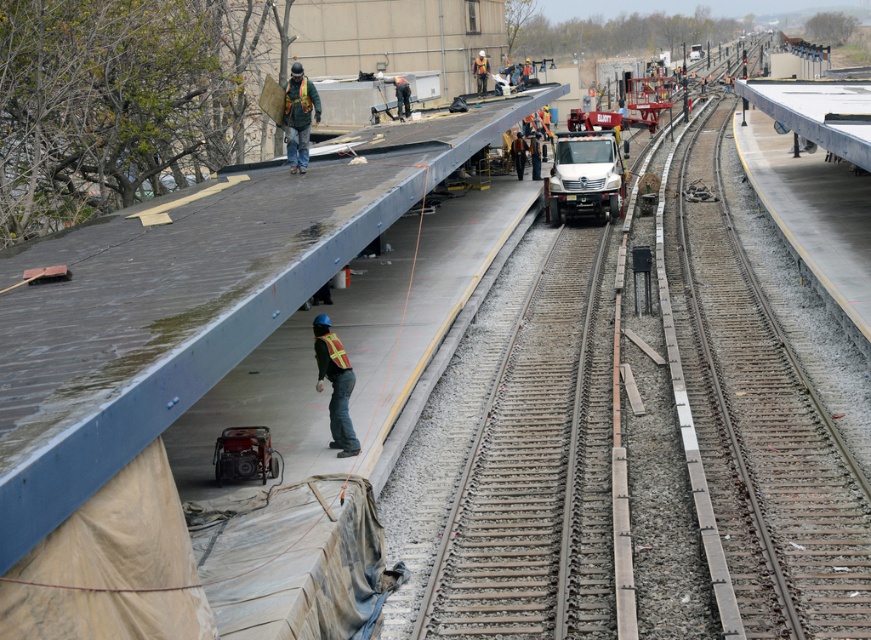
Does smooth steel tracks at center have a larger size compared to yellow reflective vest at center?

Yes, smooth steel tracks at center is bigger than yellow reflective vest at center.

Is the position of smooth steel tracks at center more distant than that of yellow reflective vest at center?

No.

The height and width of the screenshot is (640, 871). What do you see at coordinates (761, 428) in the screenshot?
I see `smooth steel tracks at center` at bounding box center [761, 428].

I want to click on smooth steel tracks at center, so (x=761, y=428).